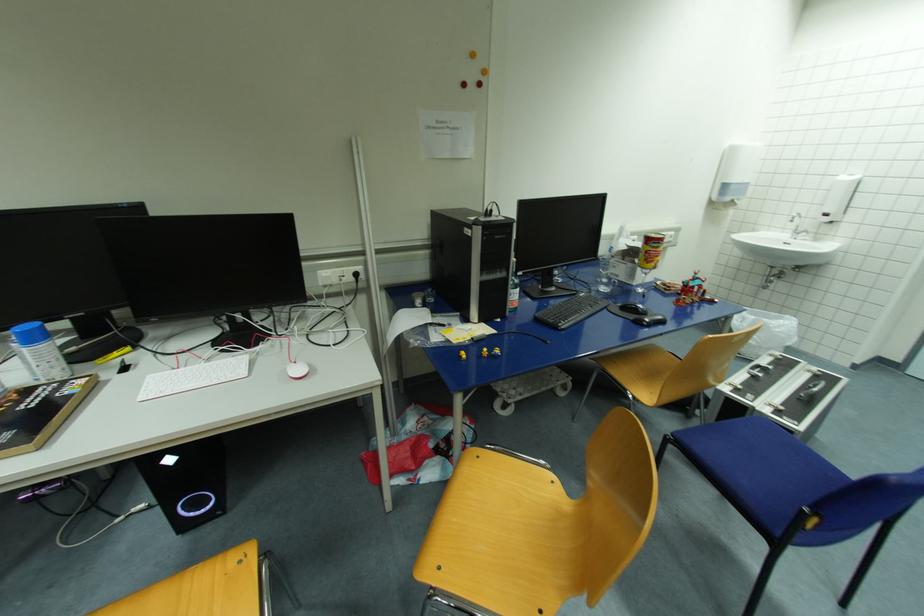
Find where to slid the white computer mouse. Please return your answer as a coordinate pair (x, y).

(297, 370)